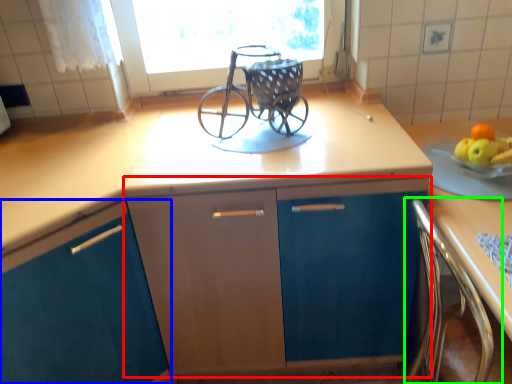
Question: Which object is the farthest from cabinetry (highlighted by a red box)? Choose among these: cabinetry (highlighted by a blue box) or chair (highlighted by a green box).

Choices:
 (A) cabinetry
 (B) chair

Answer: (B)